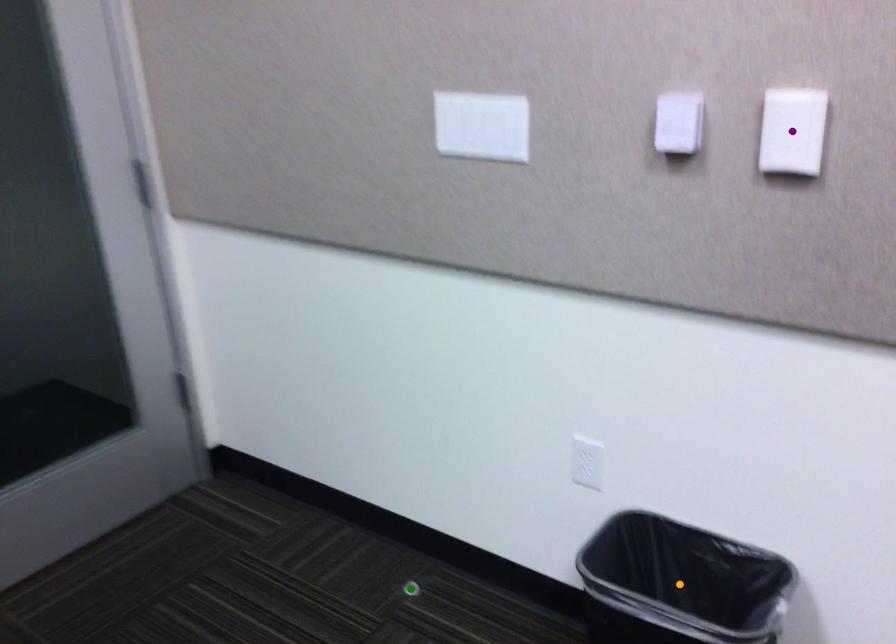
Order these from nearest to farthest:
orange point, green point, purple point

purple point → orange point → green point